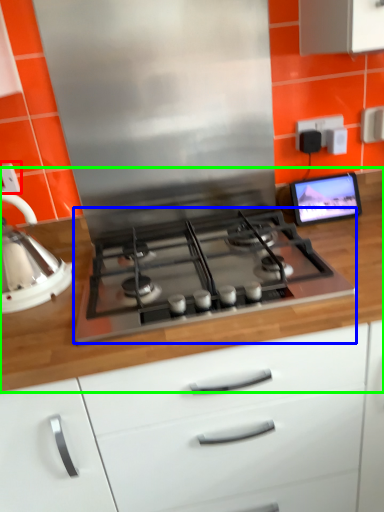
Question: Which is nearer to the electric outlet (highlighted by a red box)? gas stove (highlighted by a blue box) or countertop (highlighted by a green box).

Choices:
 (A) gas stove
 (B) countertop

Answer: (A)